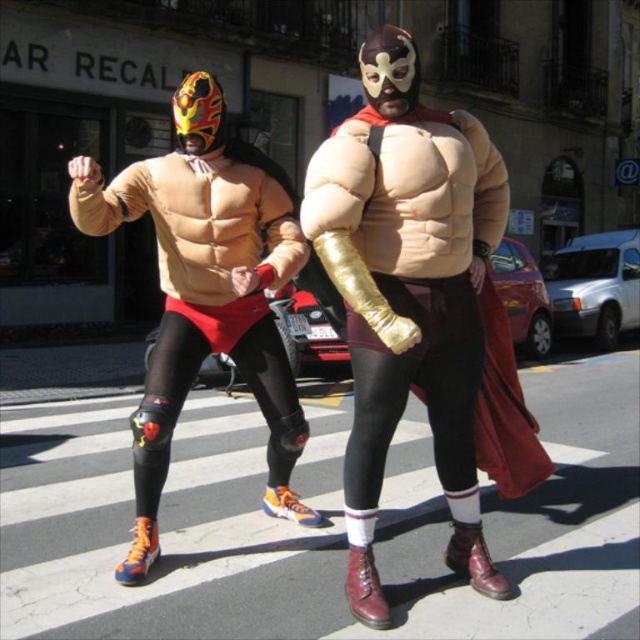
Question: Observing the image, what is the correct spatial positioning of matte gold arm at center in reference to matte orange athletic shoe at left?

Choices:
 (A) left
 (B) right

Answer: (B)

Question: Does matte gold arm at center have a smaller size compared to matte orange athletic shoe at left?

Choices:
 (A) no
 (B) yes

Answer: (B)

Question: Considering the relative positions of matte gold arm at center and matte orange athletic shoe at left in the image provided, where is matte gold arm at center located with respect to matte orange athletic shoe at left?

Choices:
 (A) left
 (B) right

Answer: (B)